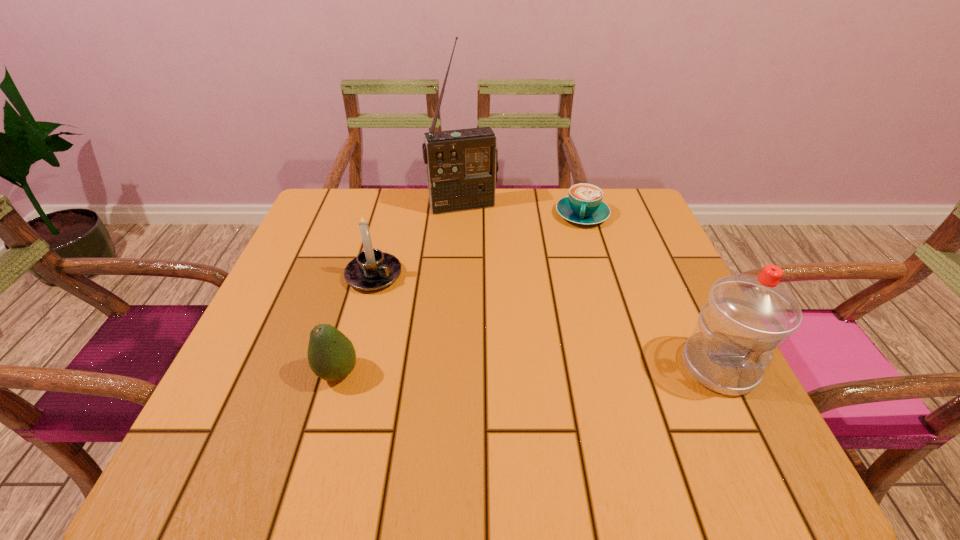
I want to click on vacant region between the rightmost object and the third shortest object, so click(x=546, y=321).

You are a GUI agent. You are given a task and a screenshot of the screen. Output one action in this format:
    pyautogui.click(x=<x>, y=<y>)
    Task: Click on the free space between the second object from right to left and the water bottle
    The image size is (960, 540).
    Given the screenshot: What is the action you would take?
    pyautogui.click(x=651, y=291)

What are the coordinates of `vacant area that lies between the third shortest object and the rightmost object` in the screenshot? It's located at (546, 321).

Identify the location of vacant area that lies between the radio receiver and the cappuccino. The height and width of the screenshot is (540, 960). (522, 210).

Locate an element on the screen. vacant space that is in between the third object from right to left and the third nearest object is located at coordinates (419, 240).

Identify the location of blank region between the third tallest object and the avocado. The image size is (960, 540). (356, 324).

Identify which object is the second closest to the third object from right to left. Please provide its 2D coordinates. Your answer should be formatted as a tuple, i.e. [(x, y)], where the tuple contains the x and y coordinates of a point satisfying the conditions above.

[(372, 269)]

This screenshot has width=960, height=540. What are the coordinates of `object that is the fourth closest to the third object from right to left` in the screenshot? It's located at (746, 317).

At what (x,y) coordinates should I click in order to perform the action: click on vacant space that satisfies the following two spatial constraints: 1. on the back side of the third tallest object; 2. on the right side of the second shortest object. Please return your answer as a coordinate pair (x, y). This screenshot has width=960, height=540. Looking at the image, I should click on (366, 275).